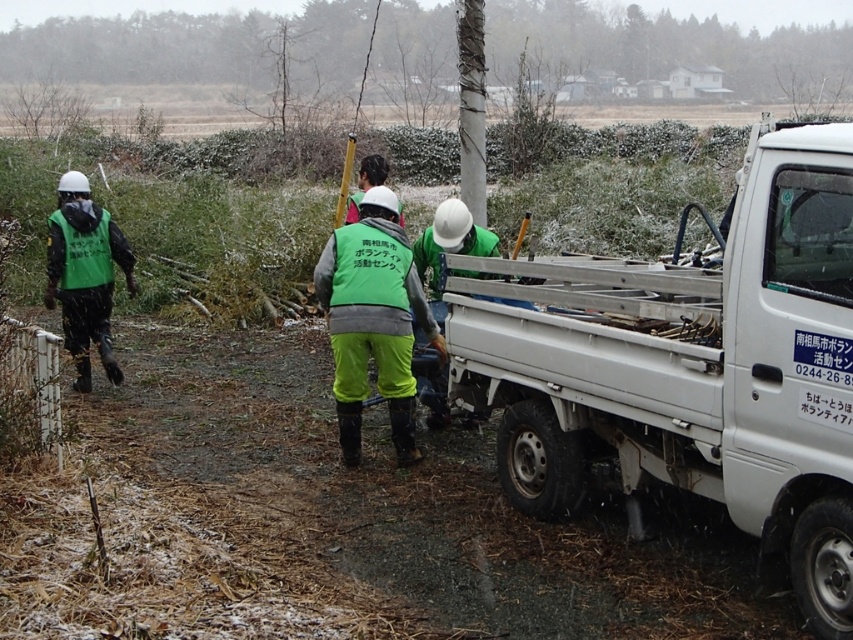
You are a safety inspector observing the outdoor work scene. You notice two safety vests worn by workers. Which worker is wearing the green matte vest at left in a higher position compared to the green fabric safety vest at center?

The green matte vest at left is above the green fabric safety vest at center, so the worker wearing the green matte vest at left is in a higher position.

You are standing at the origin of the coordinate system in the image. There are two points marked in the scene, point (86, 353) and point (65, 284). Which point is farther from your current position?

Point (86, 353) is behind point (65, 284), so it is farther from your current position at the origin.

You are a delivery person who needs to load a package onto the white metallic truck at right. The package is 1.2 meters tall. Can you safely place it on top of the truck bed without exceeding the height limit imposed by local regulations? Please consider the height of the green matte vest at left for reference.

The white metallic truck at right is taller than the green matte vest at left. Since the package is 1.2 meters tall, and the truck is taller than the vest, it is likely that the truck bed can accommodate the package without exceeding the height limit. However, the exact height of the truck is unknown, so this is an assumption based on the comparison provided.